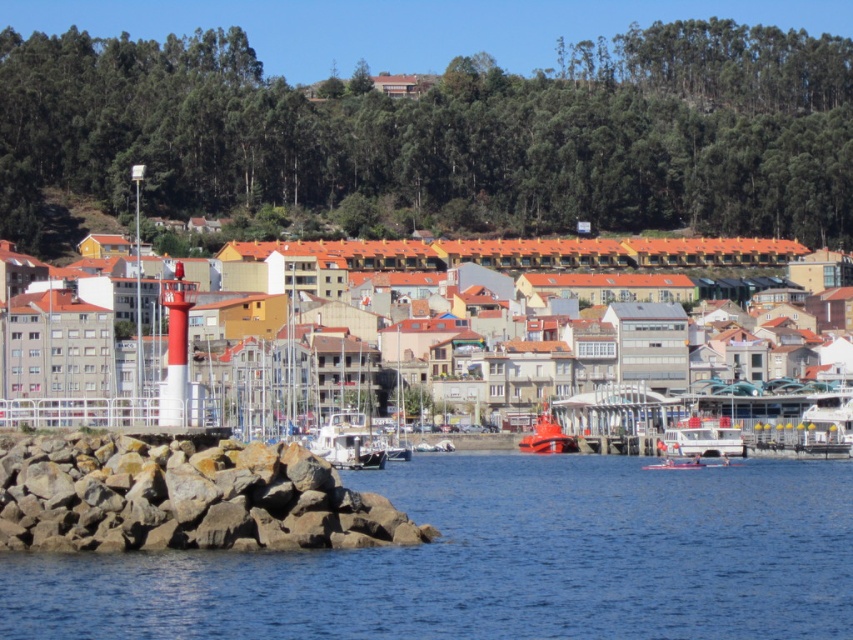
Between blue water at lower left and white plastic boat at center, which one has less height?

With less height is blue water at lower left.

Does blue water at lower left appear under white plastic boat at center?

Yes, blue water at lower left is below white plastic boat at center.

At what (x,y) coordinates should I click in order to perform the action: click on blue water at lower left. Please return your answer as a coordinate pair (x, y). Looking at the image, I should click on (497, 561).

Does smooth white lighthouse at left lie in front of white glossy boat at center?

Yes, smooth white lighthouse at left is in front of white glossy boat at center.

Who is higher up, smooth white lighthouse at left or white glossy boat at center?

smooth white lighthouse at left is higher up.

Where is `smooth white lighthouse at left`? smooth white lighthouse at left is located at coordinates (529, 268).

Who is shorter, rocky at lower left or white plastic boat at center?

Standing shorter between the two is white plastic boat at center.

Between rocky at lower left and white plastic boat at center, which one appears on the left side from the viewer's perspective?

From the viewer's perspective, rocky at lower left appears more on the left side.

Between point (170, 525) and point (851, 392), which one is positioned in front?

Point (170, 525) is more forward.

Image resolution: width=853 pixels, height=640 pixels. In order to click on rocky at lower left in this screenshot , I will do `click(184, 497)`.